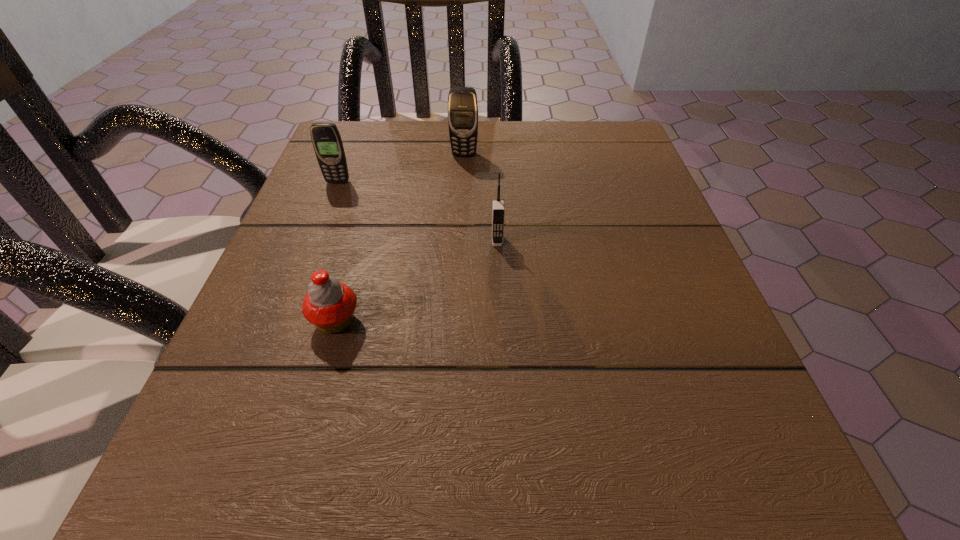
Locate an element on the screen. free space located 0.240m on the screen of the leftmost cellular telephone is located at coordinates (302, 272).

Where is `vacant space located on the right of the shortest object`? The height and width of the screenshot is (540, 960). vacant space located on the right of the shortest object is located at coordinates (575, 321).

This screenshot has height=540, width=960. Identify the location of cellular telephone at the left edge. (326, 139).

The width and height of the screenshot is (960, 540). Identify the location of cupcake situated at the left edge. (329, 304).

This screenshot has height=540, width=960. In order to click on object that is positioned at the far left corner in this screenshot , I will do `click(326, 139)`.

Where is `free space at the far edge`? Image resolution: width=960 pixels, height=540 pixels. free space at the far edge is located at coordinates 540,125.

This screenshot has width=960, height=540. In the image, there is a desktop. In order to click on free region at the left edge in this screenshot , I will do `click(262, 279)`.

Find the location of a particular element. free spot at the right edge of the desktop is located at coordinates (725, 363).

In the image, there is a desktop. At what (x,y) coordinates should I click in order to perform the action: click on blank space at the far left corner. Please return your answer as a coordinate pair (x, y). The height and width of the screenshot is (540, 960). Looking at the image, I should click on (379, 143).

Identify the location of free location at the near right corner. The height and width of the screenshot is (540, 960). (749, 471).